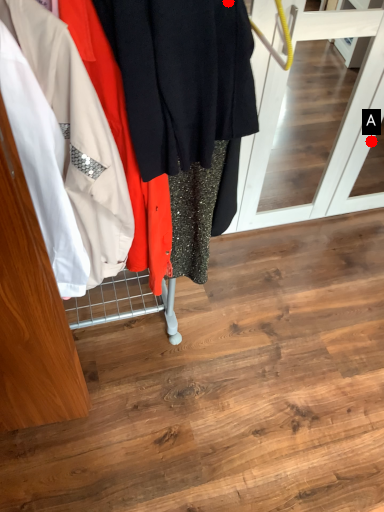
Question: Two points are circled on the image, labeled by A and B beside each circle. Which of the following is the farthest from the observer?

Choices:
 (A) A is further
 (B) B is further

Answer: (A)